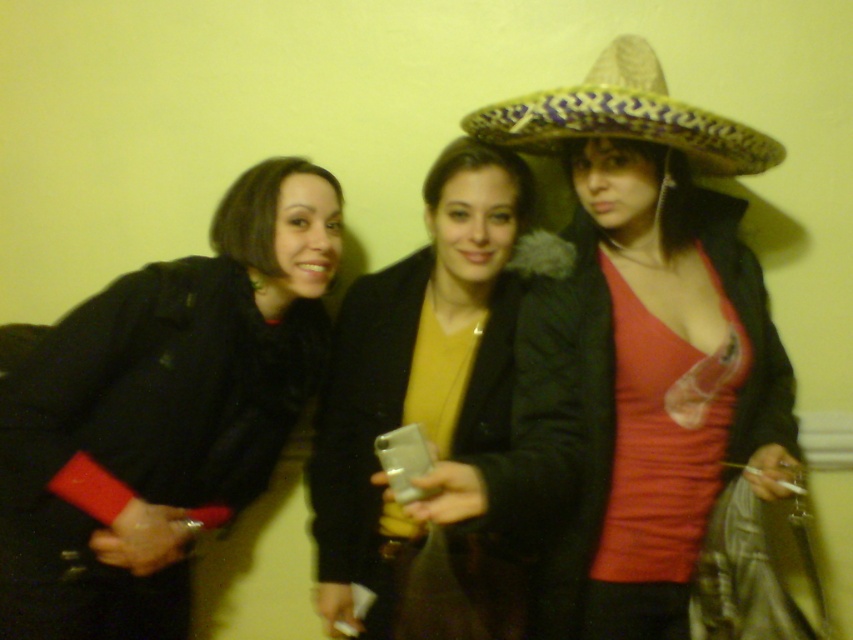
You are a photographer trying to capture a candid shot of the group. You notice the black fuzzy coat at left and the multicolored woven sombrero at center. Which object is positioned lower in the frame?

The black fuzzy coat at left is located below the multicolored woven sombrero at center, so the black fuzzy coat at left is positioned lower in the frame.